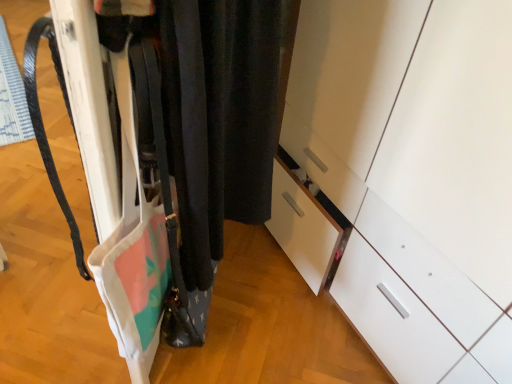
Question: Can you confirm if white matte closet at center is thinner than white glossy cabinet at center?

Choices:
 (A) no
 (B) yes

Answer: (B)

Question: From a real-world perspective, does white matte closet at center sit lower than white glossy cabinet at center?

Choices:
 (A) no
 (B) yes

Answer: (A)

Question: From a real-world perspective, is white matte closet at center physically above white glossy cabinet at center?

Choices:
 (A) no
 (B) yes

Answer: (B)

Question: Is white glossy cabinet at center located within white matte closet at center?

Choices:
 (A) yes
 (B) no

Answer: (B)

Question: Is white matte closet at center bigger than white glossy cabinet at center?

Choices:
 (A) no
 (B) yes

Answer: (A)

Question: Does white matte closet at center have a lesser height compared to white glossy cabinet at center?

Choices:
 (A) no
 (B) yes

Answer: (B)

Question: From the image's perspective, is white glossy cabinet at center above white matte closet at center?

Choices:
 (A) yes
 (B) no

Answer: (B)

Question: Is white glossy cabinet at center positioned with its back to white matte closet at center?

Choices:
 (A) yes
 (B) no

Answer: (B)

Question: Can you see white glossy cabinet at center touching white matte closet at center?

Choices:
 (A) yes
 (B) no

Answer: (B)

Question: Can you confirm if white glossy cabinet at center is bigger than white matte closet at center?

Choices:
 (A) no
 (B) yes

Answer: (B)

Question: From the image's perspective, is white glossy cabinet at center under white matte closet at center?

Choices:
 (A) no
 (B) yes

Answer: (B)

Question: Is white glossy cabinet at center far from white matte closet at center?

Choices:
 (A) no
 (B) yes

Answer: (A)

Question: In the image, is white matte closet at center positioned in front of or behind white glossy cabinet at center?

Choices:
 (A) behind
 (B) front

Answer: (B)